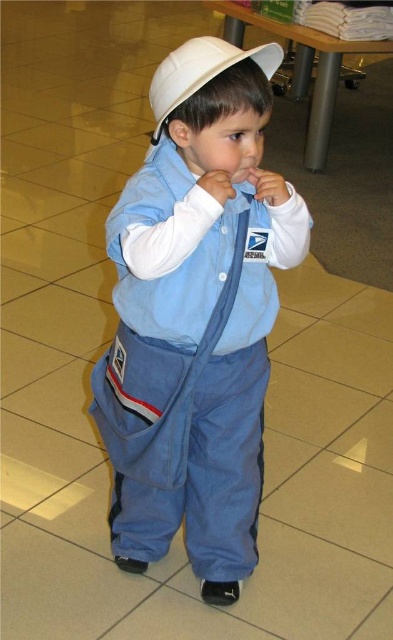
You are a fashion designer observing a child wearing a blue denim jumpsuit at center and a white matte baseball hat at center. Which clothing item is wider?

The blue denim jumpsuit at center is wider than the white matte baseball hat at center according to the description.

The child is wearing a blue denim jumpsuit at center and a white matte baseball hat at center. Which item is closer to the front?

The blue denim jumpsuit at center is closer to the front because the white matte baseball hat at center is behind it.